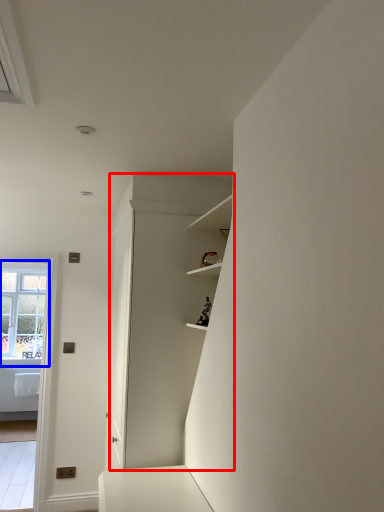
Question: Which point is further to the camera, dresser (highlighted by a red box) or window (highlighted by a blue box)?

Choices:
 (A) dresser
 (B) window

Answer: (B)